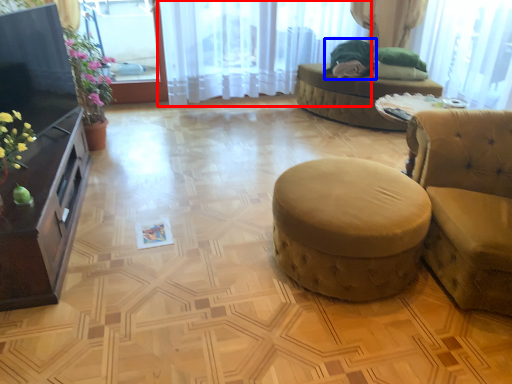
Question: Which of the following is the closest to the observer, curtain (highlighted by a red box) or open (highlighted by a blue box)?

Choices:
 (A) curtain
 (B) open

Answer: (A)